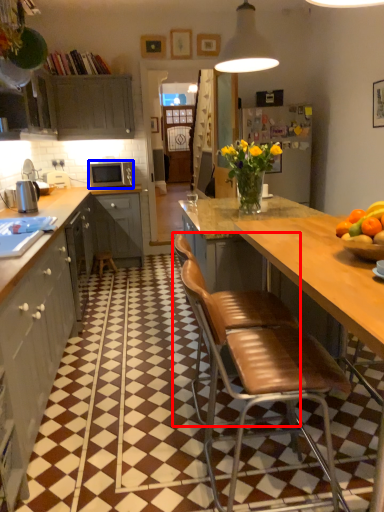
Question: Which of the following is the closest to the observer, chair (highlighted by a red box) or microwave oven (highlighted by a blue box)?

Choices:
 (A) chair
 (B) microwave oven

Answer: (A)